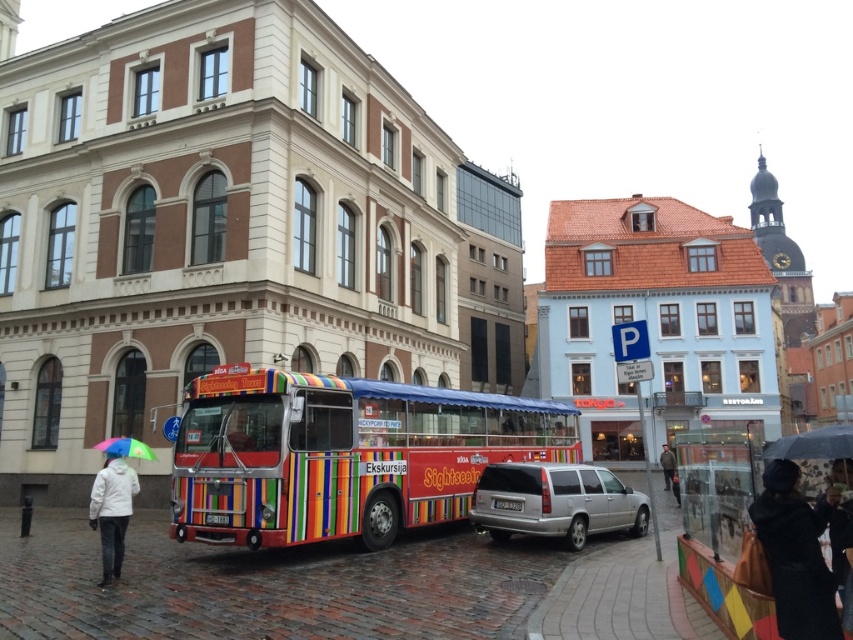
You are a tourist standing at the camera position in front of the double decker bus. You see a black leather coat at lower right. Can you pick it up without leaving the cobblestone street?

The black leather coat at lower right is 21.28 meters from the camera, so you would need to walk 21.28 meters to reach it. Since you can walk on the cobblestone street, you can pick it up without leaving the cobblestone street.

You are standing at the point closest to the bus. Which of the two points, point [364,515] or point [132,442], is farther away from you?

Point [364,515] is farther away from you because it is behind point [132,442], which is closer.